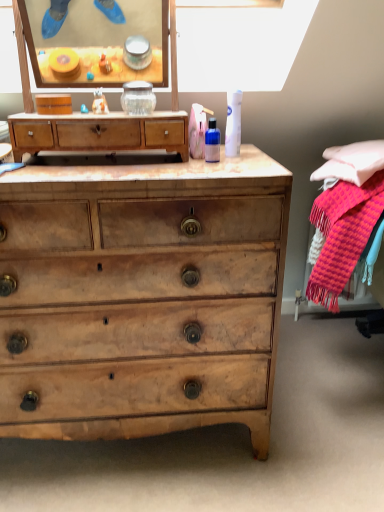
Find the location of `free point in front of white matte canister at upper center, acting as the first toiletry starting from the right`. free point in front of white matte canister at upper center, acting as the first toiletry starting from the right is located at coordinates (232, 162).